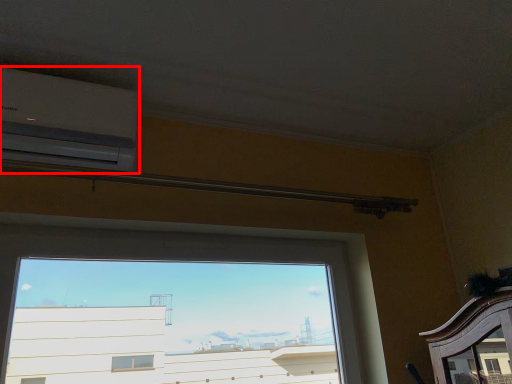
Question: In this image, where is air conditioning (annotated by the red box) located relative to window?

Choices:
 (A) left
 (B) right

Answer: (A)